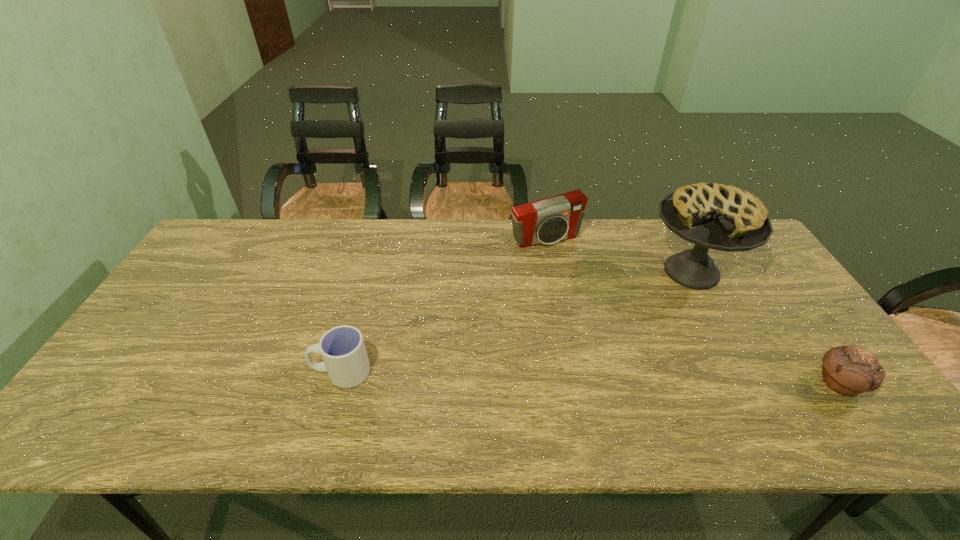
Identify the location of free space between the second object from left to right and the leftmost object. Image resolution: width=960 pixels, height=540 pixels. (444, 305).

This screenshot has height=540, width=960. Find the location of `unoccupied area between the second object from left to right and the pie`. unoccupied area between the second object from left to right and the pie is located at coordinates (618, 255).

I want to click on vacant area that lies between the leftmost object and the tallest object, so click(x=516, y=322).

Find the location of a particular element. vacant area that lies between the camera and the pie is located at coordinates (618, 255).

The height and width of the screenshot is (540, 960). I want to click on vacant point located between the tallest object and the cup, so click(x=516, y=322).

You are a GUI agent. You are given a task and a screenshot of the screen. Output one action in this format:
    pyautogui.click(x=<x>, y=<y>)
    Task: Click on the vacant region between the second object from left to right and the rightmost object
    The image size is (960, 540).
    Given the screenshot: What is the action you would take?
    pyautogui.click(x=692, y=311)

The height and width of the screenshot is (540, 960). Identify the location of vacant space that is in between the third object from right to left and the cup. (444, 305).

Where is `empty location between the muffin and the tallest object`? empty location between the muffin and the tallest object is located at coordinates (765, 328).

Find the location of a particular element. This screenshot has height=540, width=960. free space between the third shortest object and the leftmost object is located at coordinates (444, 305).

You are a GUI agent. You are given a task and a screenshot of the screen. Output one action in this format:
    pyautogui.click(x=<x>, y=<y>)
    Task: Click on the free space between the camera and the pie
    The width and height of the screenshot is (960, 540).
    Given the screenshot: What is the action you would take?
    pyautogui.click(x=618, y=255)